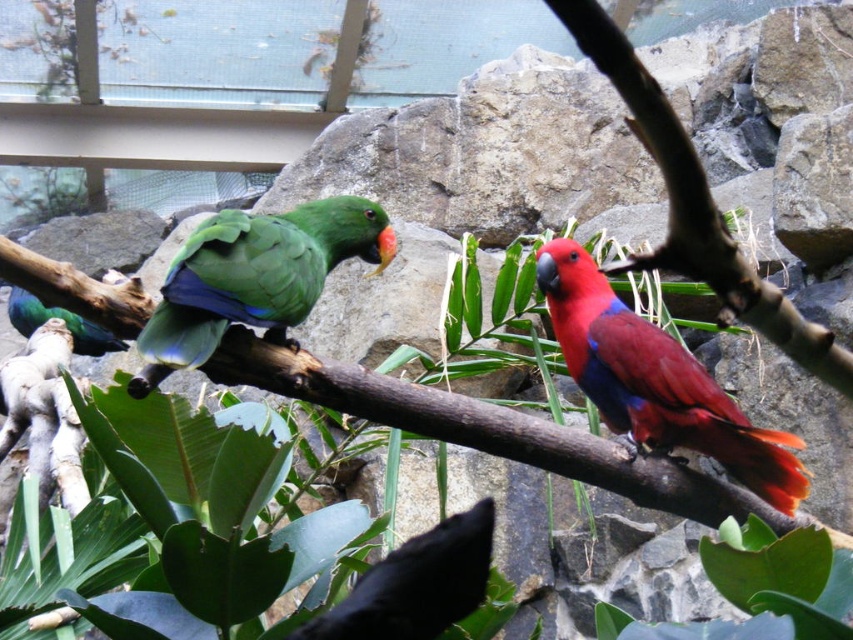
Question: Is green matte branch at upper left below shiny crimson parrot at right?

Choices:
 (A) yes
 (B) no

Answer: (A)

Question: Which object appears closest to the camera in this image?

Choices:
 (A) shiny green parrot at left
 (B) shiny crimson parrot at right

Answer: (B)

Question: Which object is the farthest from the green matte branch at upper left?

Choices:
 (A) shiny crimson parrot at right
 (B) green glossy parrot at left

Answer: (A)

Question: Can you confirm if green matte branch at upper left is positioned above shiny green parrot at left?

Choices:
 (A) no
 (B) yes

Answer: (A)

Question: Which point is farther to the camera?

Choices:
 (A) green glossy parrot at left
 (B) shiny green parrot at left
 (C) shiny crimson parrot at right

Answer: (B)

Question: Can you confirm if green matte branch at upper left is smaller than shiny green parrot at left?

Choices:
 (A) no
 (B) yes

Answer: (A)